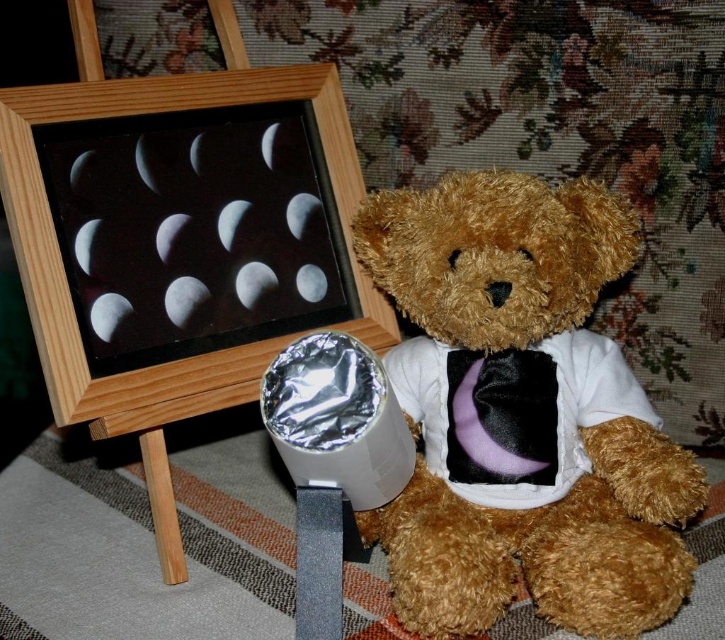
You are a fashion designer observing the fuzzy brown teddy bear at center and the purple velvet tie at center. Which item would you say is bigger in size?

The fuzzy brown teddy bear at center is larger in size compared to the purple velvet tie at center.

Based on the scene description, what are the coordinates of the fuzzy brown teddy bear at center?

The fuzzy brown teddy bear at center is located at coordinates (522, 413).

You are standing in front of the teddy bear. Which object is located at the coordinates point (181, 358)?

The wooden picture frame at left is located at the coordinates point (181, 358).